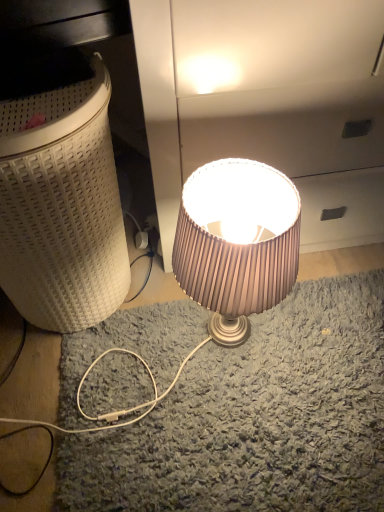
Question: Would you say satin beige lampshade at center is inside or outside white woven laundry basket at left?

Choices:
 (A) inside
 (B) outside

Answer: (B)

Question: Considering the positions of satin beige lampshade at center and white woven laundry basket at left in the image, is satin beige lampshade at center taller or shorter than white woven laundry basket at left?

Choices:
 (A) short
 (B) tall

Answer: (A)

Question: Considering the positions of satin beige lampshade at center and white woven laundry basket at left in the image, is satin beige lampshade at center wider or thinner than white woven laundry basket at left?

Choices:
 (A) thin
 (B) wide

Answer: (A)

Question: Considering their positions, is white woven laundry basket at left located in front of or behind satin beige lampshade at center?

Choices:
 (A) front
 (B) behind

Answer: (A)

Question: Is white woven laundry basket at left wider or thinner than satin beige lampshade at center?

Choices:
 (A) thin
 (B) wide

Answer: (B)

Question: Looking at the image, does white woven laundry basket at left seem bigger or smaller compared to satin beige lampshade at center?

Choices:
 (A) small
 (B) big

Answer: (B)

Question: Based on their positions, is white woven laundry basket at left located to the left or right of satin beige lampshade at center?

Choices:
 (A) left
 (B) right

Answer: (A)